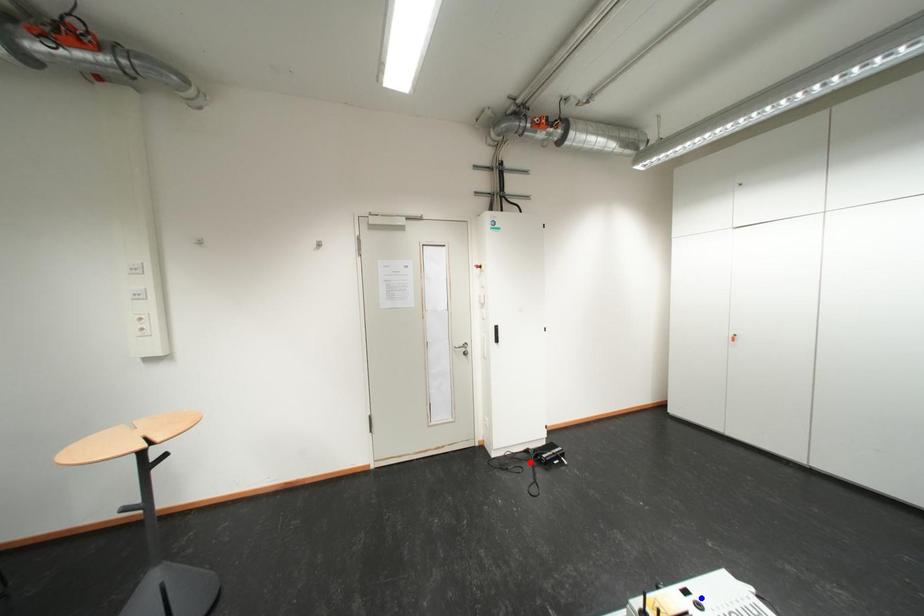
Question: In the image, two points are highlighted. Which point is nearer to the camera? Reply with the corresponding letter.

Choices:
 (A) blue point
 (B) red point

Answer: (A)